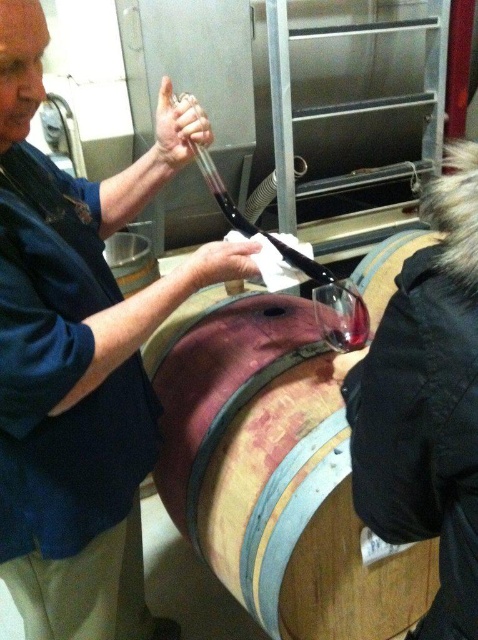
Is matte black wine barrel at center further to camera compared to wooden barrel at center?

No, it is in front of wooden barrel at center.

Between point (77, 307) and point (380, 621), which one is positioned in front?

Point (77, 307) is in front.

Between point (79, 221) and point (390, 616), which one is positioned in front?

Point (79, 221)

Identify the location of matte black wine barrel at center. The image size is (478, 640). (79, 360).

Based on the photo, is wooden barrel at center taller than transparent glass at center?

Yes, wooden barrel at center is taller than transparent glass at center.

Consider the image. Which is above, wooden barrel at center or transparent glass at center?

transparent glass at center is higher up.

Does point (249, 442) come farther from viewer compared to point (345, 324)?

No, it is not.

Image resolution: width=478 pixels, height=640 pixels. I want to click on wooden barrel at center, so click(272, 472).

Is wooden barrel at center to the right of translucent glass wine at center from the viewer's perspective?

Incorrect, wooden barrel at center is not on the right side of translucent glass wine at center.

Locate an element on the screen. wooden barrel at center is located at coordinates (x=272, y=472).

Identify the location of wooden barrel at center. (272, 472).